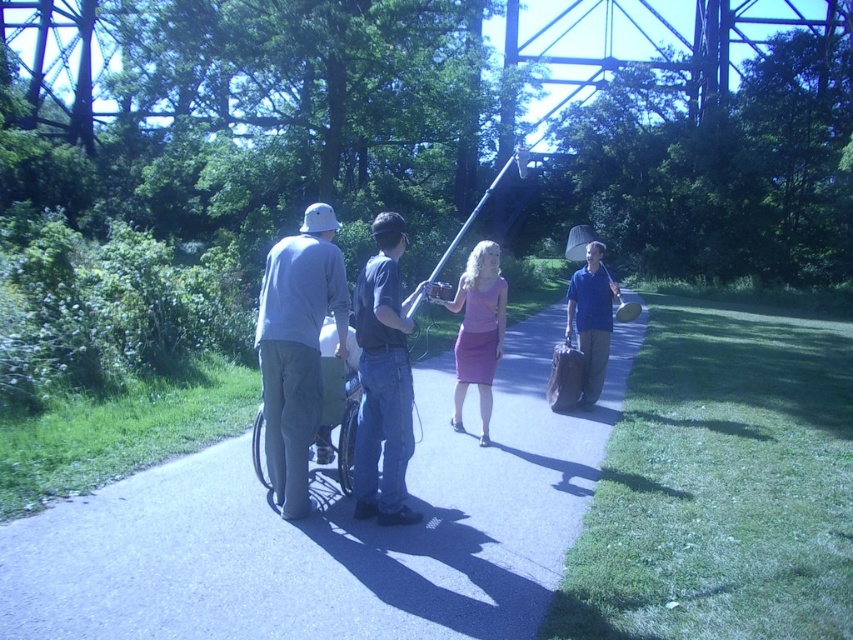
Question: Is denim jeans at center to the right of purple satin dress at center from the viewer's perspective?

Choices:
 (A) no
 (B) yes

Answer: (A)

Question: Is purple satin dress at center wider than blue cotton shirt at center-right?

Choices:
 (A) no
 (B) yes

Answer: (A)

Question: In this image, where is gray cotton shirt at center located relative to denim jeans at center?

Choices:
 (A) left
 (B) right

Answer: (A)

Question: Which point is closer to the camera?

Choices:
 (A) blue cotton shirt at center-right
 (B) purple satin dress at center

Answer: (B)

Question: Which point is farther to the camera?

Choices:
 (A) blue cotton shirt at center-right
 (B) asphalt pavement at center

Answer: (A)

Question: Which object is positioned closest to the blue cotton shirt at center-right?

Choices:
 (A) gray cotton shirt at center
 (B) denim jeans at center

Answer: (B)